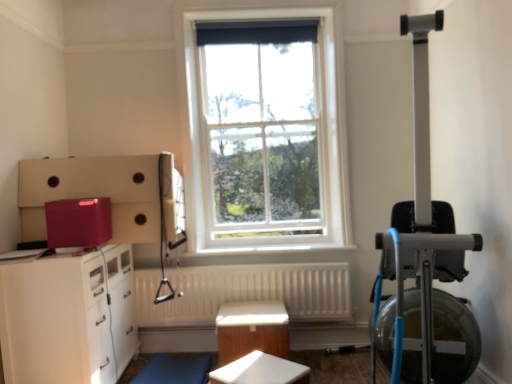
The image size is (512, 384). I want to click on free space underneath white textured radiator at center (from a real-world perspective), so click(x=215, y=335).